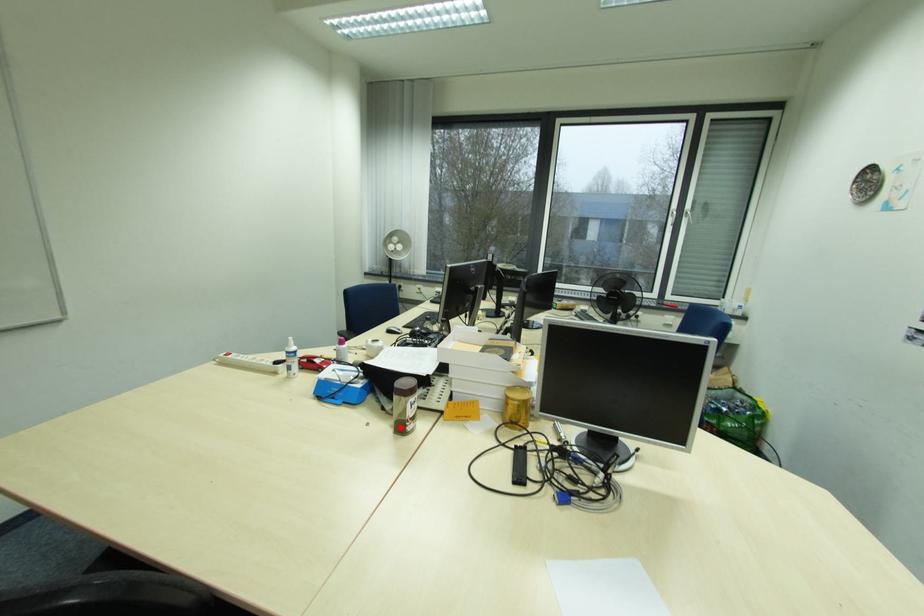
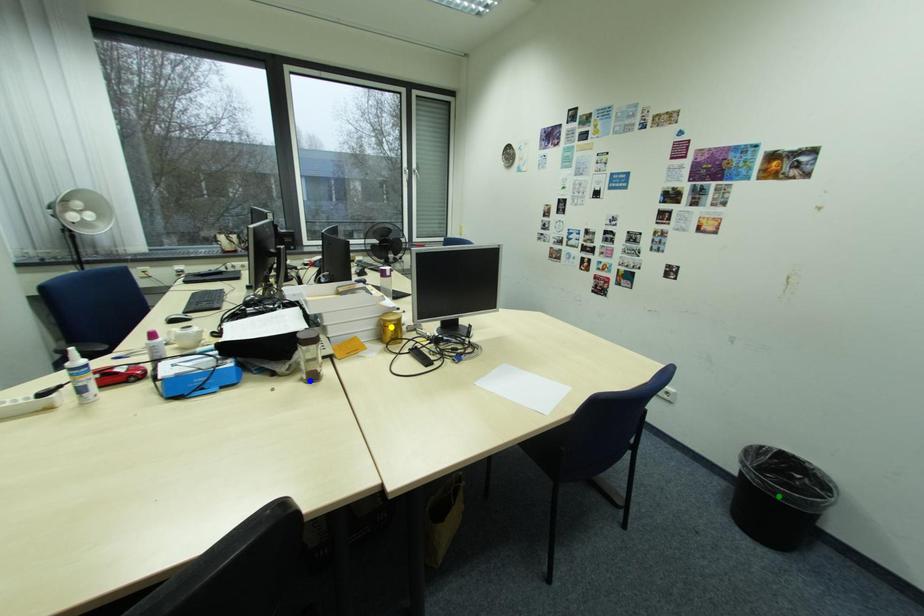
Question: I am providing you with two images of the same scene from different viewpoints. A red point is marked on the first image. You are given multiple points on the second image. Which spot in image 2 lines up with the point in image 1?

Choices:
 (A) green point
 (B) blue point
 (C) yellow point

Answer: (B)